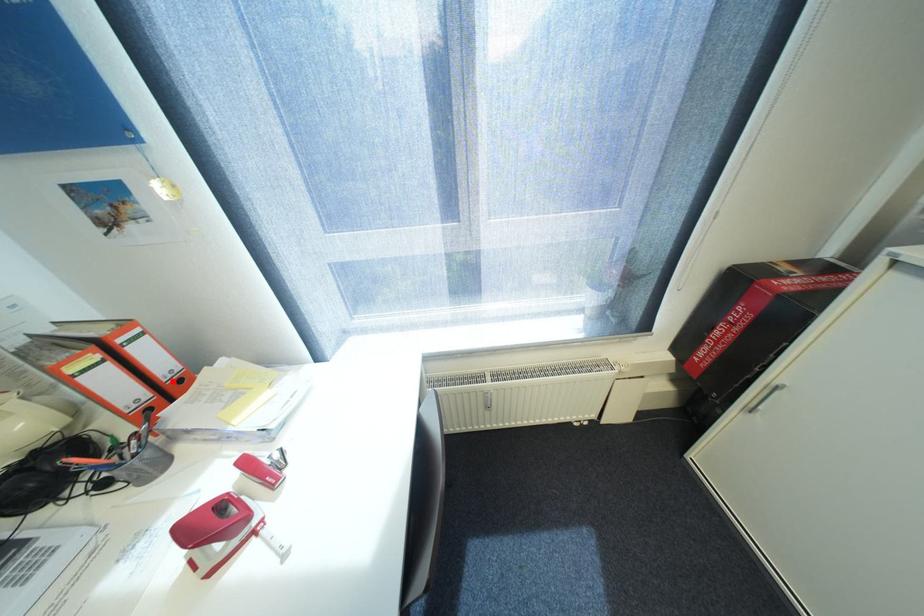
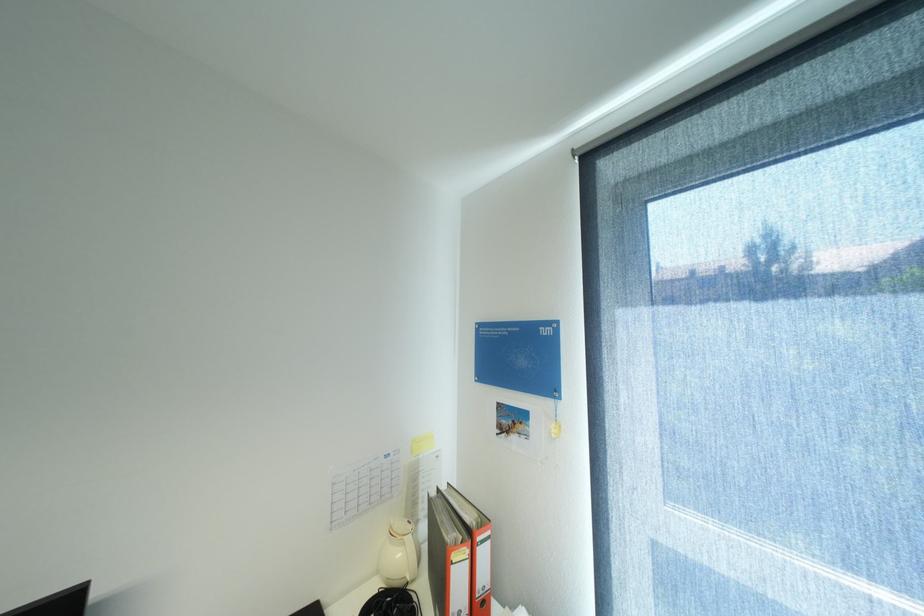
Where in the second image is the point corresponding to the highlighted location from the first image?

(484, 597)